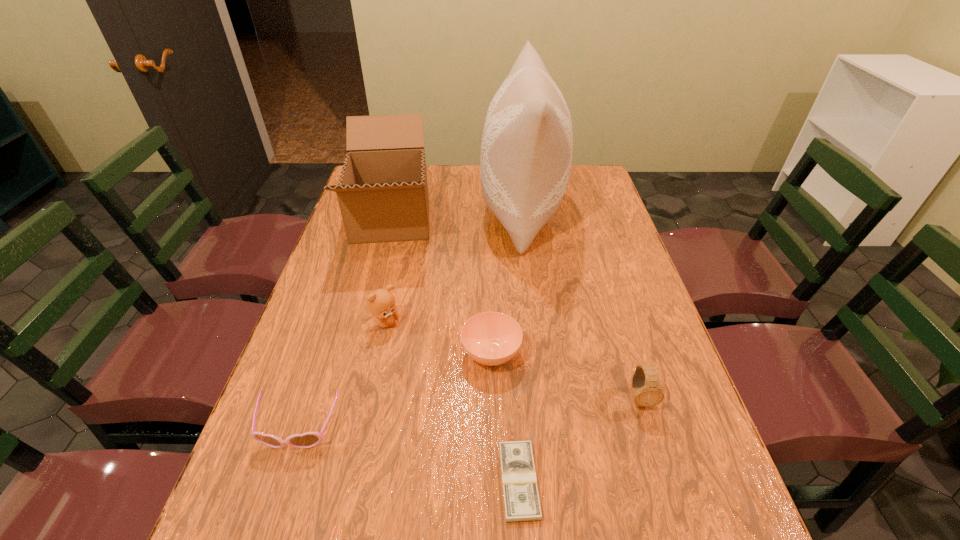
Locate an element on the screen. The image size is (960, 540). object positioned at the right edge is located at coordinates (648, 393).

You are a GUI agent. You are given a task and a screenshot of the screen. Output one action in this format:
    pyautogui.click(x=<x>, y=<y>)
    Task: Click on the object at the far left corner
    
    Given the screenshot: What is the action you would take?
    pyautogui.click(x=382, y=192)

In order to click on free spot at the far edge of the desktop in this screenshot , I will do `click(429, 189)`.

The height and width of the screenshot is (540, 960). What are the coordinates of `vacant space at the left edge` in the screenshot? It's located at (343, 355).

At what (x,y) coordinates should I click in order to perform the action: click on free space at the right edge of the desktop. Please return your answer as a coordinate pair (x, y). The height and width of the screenshot is (540, 960). Looking at the image, I should click on (710, 455).

Where is `unoccupied position between the box and the tallest object`? The image size is (960, 540). unoccupied position between the box and the tallest object is located at coordinates (456, 215).

The image size is (960, 540). Find the location of `blank region between the watch and the box`. blank region between the watch and the box is located at coordinates (516, 308).

Identify the location of vacant space that's between the box and the teddy bear. This screenshot has height=540, width=960. (389, 271).

I want to click on free spot between the sunglasses and the box, so click(345, 323).

I want to click on vacant space that is in between the soup bowl and the tallest object, so 506,282.